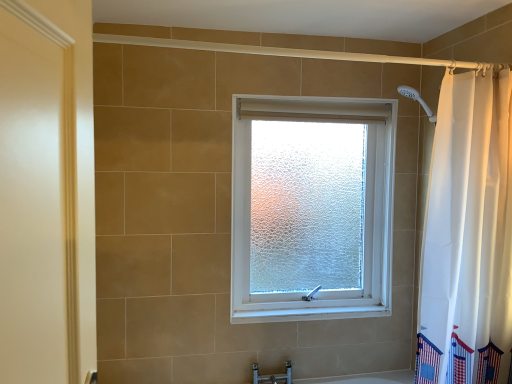
Question: From the image's perspective, is matte silver faucet at lower center above or below white fabric curtain at right?

Choices:
 (A) above
 (B) below

Answer: (B)

Question: In terms of size, does matte silver faucet at lower center appear bigger or smaller than white fabric curtain at right?

Choices:
 (A) big
 (B) small

Answer: (B)

Question: Which of these objects is positioned farthest from the frosted glass window at center?

Choices:
 (A) matte silver faucet at lower center
 (B) white fabric curtain at right

Answer: (A)

Question: Based on their relative distances, which object is nearer to the frosted glass window at center?

Choices:
 (A) matte silver faucet at lower center
 (B) white fabric curtain at right

Answer: (B)